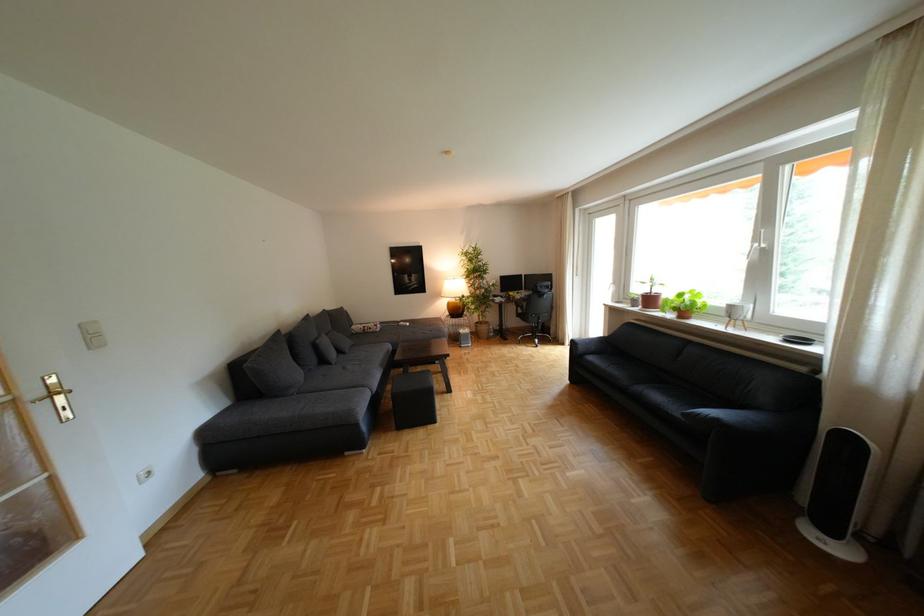
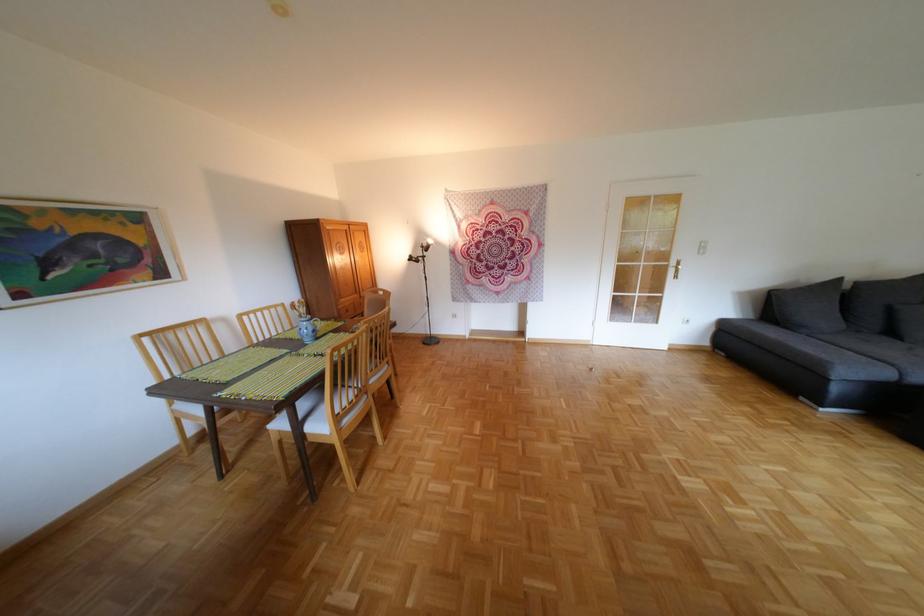
The point at (257, 377) is marked in the first image. Where is the corresponding point in the second image?

(787, 304)